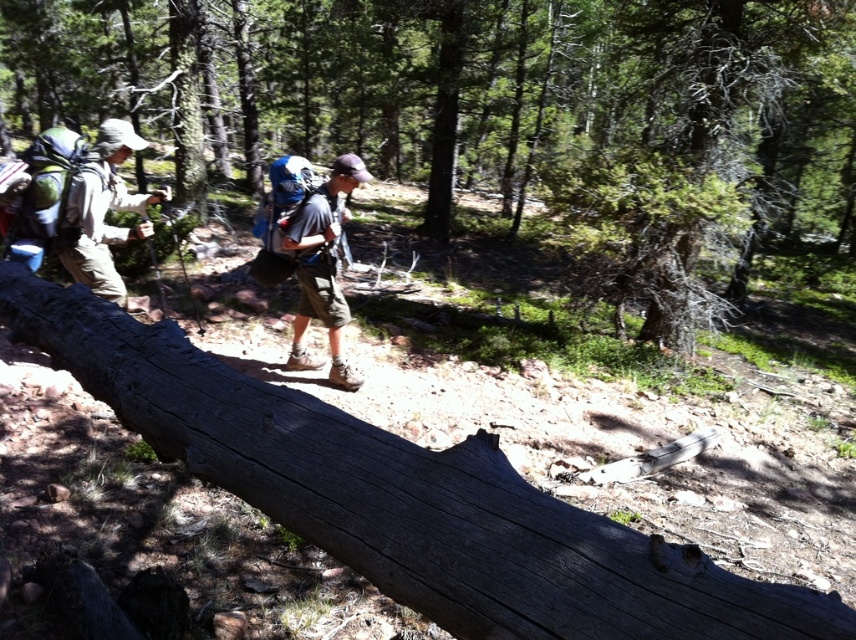
Which of these two, matte khaki pants at left or matte blue backpack at center, stands taller?

matte blue backpack at center

Does point (64, 237) come in front of point (313, 282)?

Yes, it is in front of point (313, 282).

Image resolution: width=856 pixels, height=640 pixels. I want to click on matte khaki pants at left, so click(x=102, y=212).

From the picture: Is gray rough wood log at center further to the viewer compared to matte khaki pants at left?

No, gray rough wood log at center is closer to the viewer.

Does gray rough wood log at center have a lesser width compared to matte khaki pants at left?

No, gray rough wood log at center is not thinner than matte khaki pants at left.

Describe the element at coordinates (403, 497) in the screenshot. I see `gray rough wood log at center` at that location.

I want to click on gray rough wood log at center, so click(403, 497).

Who is taller, smooth gray log at center or gray rough wood log at center?

Standing taller between the two is smooth gray log at center.

Who is more forward, (194, 68) or (675, 560)?

Point (675, 560)

Is point (400, 52) positioned behind point (468, 561)?

Yes, it is.

Locate an element on the screen. This screenshot has height=640, width=856. smooth gray log at center is located at coordinates [496, 113].